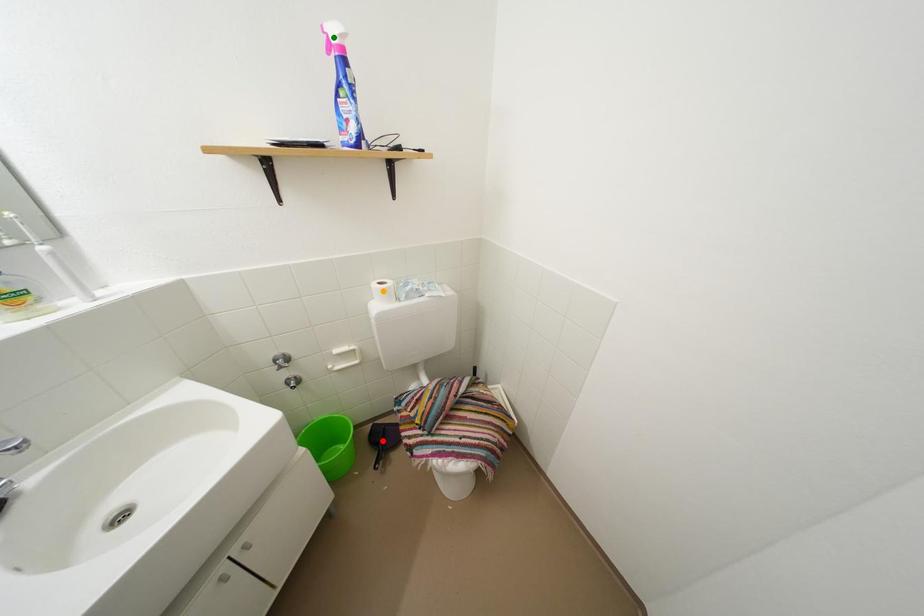
Order these from nearest to farthest:
- green point
- red point
- orange point

green point < orange point < red point